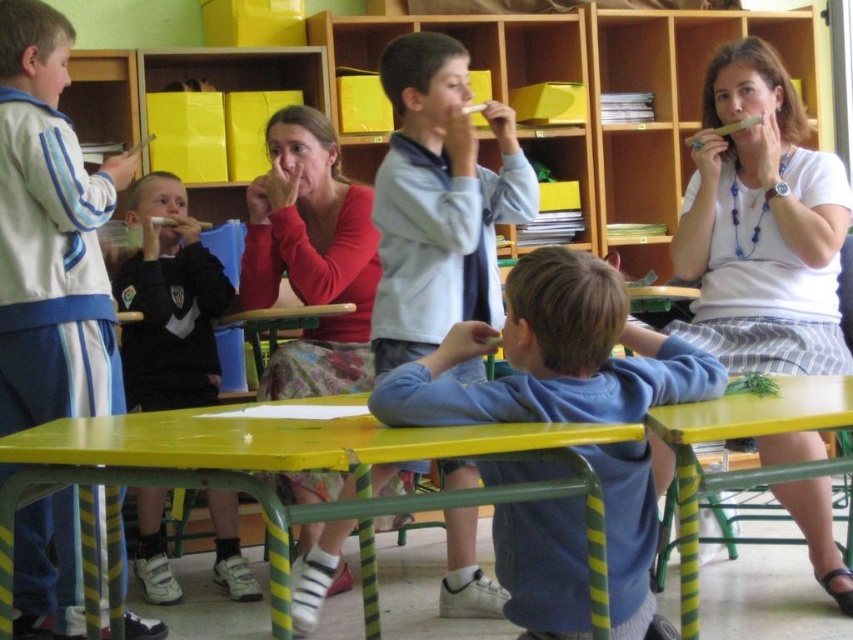
Which is above, white matte shirt at upper right or yellow painted wood table at lower center?

Positioned higher is white matte shirt at upper right.

Does white matte shirt at upper right have a greater height compared to yellow painted wood table at lower center?

Indeed, white matte shirt at upper right has a greater height compared to yellow painted wood table at lower center.

Identify the location of white matte shirt at upper right. (761, 225).

Who is taller, yellow painted wood table at lower center or light blue fleece jacket at center?

light blue fleece jacket at center is taller.

Who is more distant from viewer, (99,420) or (508,161)?

The point (508,161) is behind.

Does point (485, 500) come closer to viewer compared to point (381, 208)?

Yes.

Where is `yellow painted wood table at lower center`? Image resolution: width=853 pixels, height=640 pixels. yellow painted wood table at lower center is located at coordinates (x=294, y=468).

What do you see at coordinates (552, 356) in the screenshot? I see `blue fleece sweater at center` at bounding box center [552, 356].

Does blue fleece sweater at center have a lesser width compared to yellow painted wood table at lower center?

Correct, blue fleece sweater at center's width is less than yellow painted wood table at lower center's.

Where is `blue fleece sweater at center`? This screenshot has height=640, width=853. blue fleece sweater at center is located at coordinates pyautogui.click(x=552, y=356).